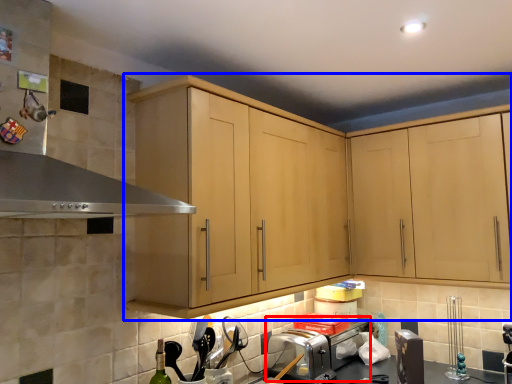
Question: Which point is further to the camera, toaster (highlighted by a red box) or cabinetry (highlighted by a blue box)?

Choices:
 (A) toaster
 (B) cabinetry

Answer: (A)